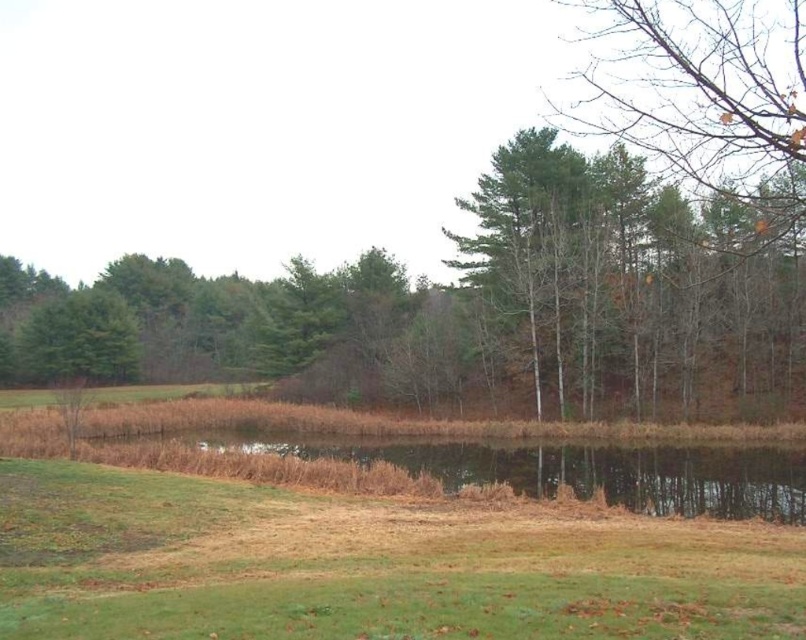
Question: From the image, what is the correct spatial relationship of green grassy at lower left in relation to brown grassy lake at center?

Choices:
 (A) above
 (B) below

Answer: (A)

Question: Is green grassy at lower left closer to camera compared to brown grassy lake at center?

Choices:
 (A) yes
 (B) no

Answer: (A)

Question: Does green grassy at lower left have a greater width compared to brown grassy lake at center?

Choices:
 (A) yes
 (B) no

Answer: (B)

Question: Which point is closer to the camera taking this photo?

Choices:
 (A) (401, 464)
 (B) (28, 625)

Answer: (B)

Question: Which object appears farthest from the camera in this image?

Choices:
 (A) brown grassy lake at center
 (B) green grassy at lower left

Answer: (A)

Question: Which point is closer to the camera?

Choices:
 (A) brown grassy lake at center
 (B) green grassy at lower left

Answer: (B)